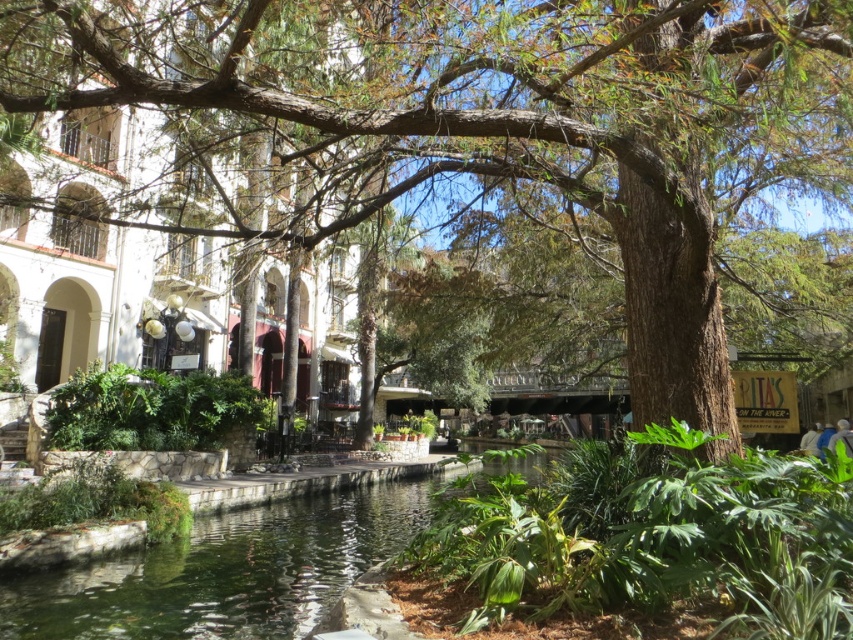
Which of these two, brown textured tree at center or green liquid water at center, stands taller?

green liquid water at center

Is brown textured tree at center in front of green liquid water at center?

Yes, it is in front of green liquid water at center.

Where is `brown textured tree at center`? The height and width of the screenshot is (640, 853). brown textured tree at center is located at coordinates (491, 124).